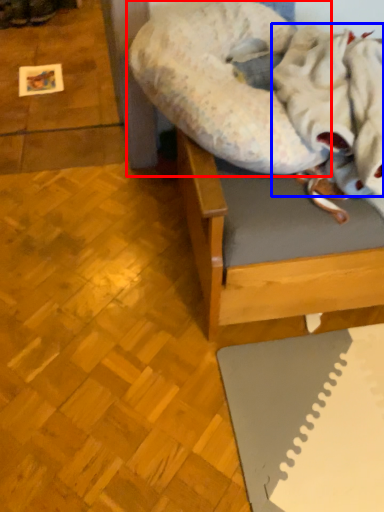
Question: Which of the following is the closest to the observer, dog bed (highlighted by a red box) or blanket (highlighted by a blue box)?

Choices:
 (A) dog bed
 (B) blanket

Answer: (B)